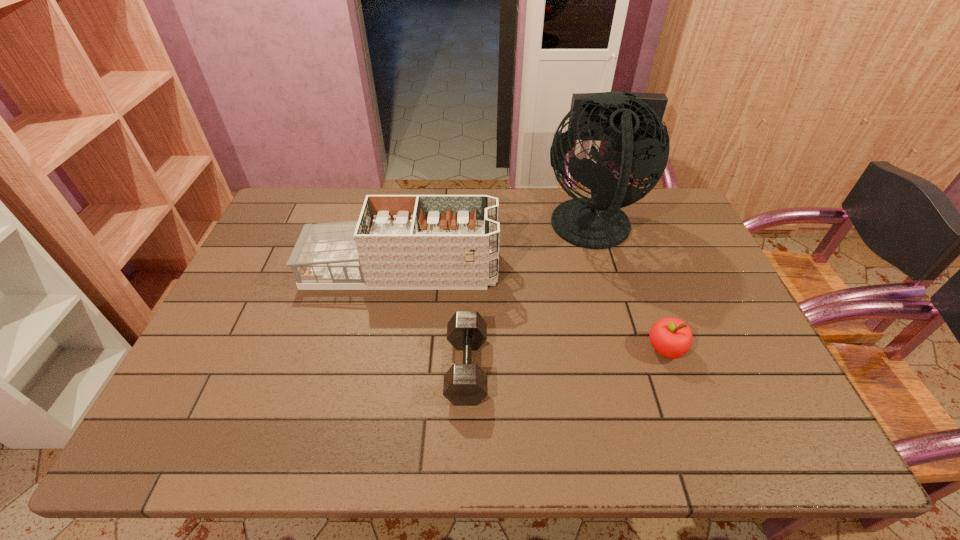
Image resolution: width=960 pixels, height=540 pixels. Find the location of `free space that satisfies the following two spatial constraints: 1. at the entrance of the dollhouse; 2. on the left side of the second shortest object`. free space that satisfies the following two spatial constraints: 1. at the entrance of the dollhouse; 2. on the left side of the second shortest object is located at coordinates (387, 349).

Find the location of a particular element. The image size is (960, 540). free space that satisfies the following two spatial constraints: 1. on the front-facing side of the third tallest object; 2. on the left side of the tallest object is located at coordinates (626, 349).

The height and width of the screenshot is (540, 960). In order to click on vacant space that satisfies the following two spatial constraints: 1. on the front-facing side of the apple; 2. on the left side of the globe in this screenshot , I will do `click(626, 349)`.

At what (x,y) coordinates should I click in order to perform the action: click on vacant region that satisfies the following two spatial constraints: 1. on the front-facing side of the globe; 2. on the back side of the apple. Please return your answer as a coordinate pair (x, y). This screenshot has width=960, height=540. Looking at the image, I should click on (626, 349).

Identify the location of vacant region that satisfies the following two spatial constraints: 1. at the entrance of the apple; 2. on the right side of the second tallest object. (387, 349).

Where is `free spot that satisfies the following two spatial constraints: 1. on the back side of the second shortest object; 2. at the entrance of the third shortest object`? Image resolution: width=960 pixels, height=540 pixels. free spot that satisfies the following two spatial constraints: 1. on the back side of the second shortest object; 2. at the entrance of the third shortest object is located at coordinates (636, 269).